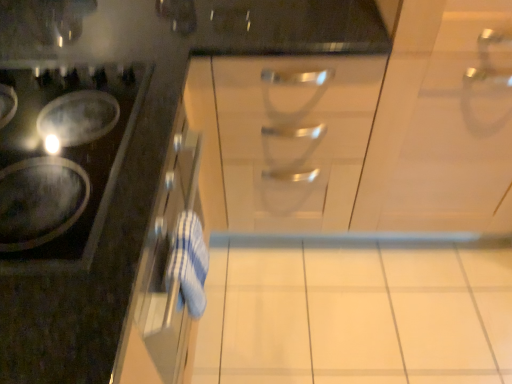
Question: Considering the relative sizes of white glossy cabinet at center, which is the second cabinetry in left-to-right order, and white glossy tile at center in the image provided, is white glossy cabinet at center, which is the second cabinetry in left-to-right order, smaller than white glossy tile at center?

Choices:
 (A) yes
 (B) no

Answer: (B)

Question: Is white glossy cabinet at center, which is the second cabinetry in left-to-right order, at the right side of white glossy tile at center?

Choices:
 (A) yes
 (B) no

Answer: (A)

Question: Does white glossy cabinet at center, the first cabinetry positioned from the right, have a lesser height compared to white glossy tile at center?

Choices:
 (A) no
 (B) yes

Answer: (A)

Question: Does white glossy cabinet at center, the first cabinetry positioned from the right, appear on the left side of white glossy tile at center?

Choices:
 (A) no
 (B) yes

Answer: (A)

Question: From a real-world perspective, is white glossy cabinet at center, the first cabinetry positioned from the right, positioned under white glossy tile at center based on gravity?

Choices:
 (A) no
 (B) yes

Answer: (A)

Question: From the image's perspective, is white glossy cabinet at center, which is the second cabinetry in left-to-right order, under white glossy tile at center?

Choices:
 (A) no
 (B) yes

Answer: (A)

Question: From the image's perspective, would you say shiny black cooktop at left is positioned over satin silver drawer at center?

Choices:
 (A) yes
 (B) no

Answer: (B)

Question: Is shiny black cooktop at left thinner than satin silver drawer at center?

Choices:
 (A) yes
 (B) no

Answer: (A)

Question: Is shiny black cooktop at left shorter than satin silver drawer at center?

Choices:
 (A) yes
 (B) no

Answer: (A)

Question: Does shiny black cooktop at left come behind satin silver drawer at center?

Choices:
 (A) yes
 (B) no

Answer: (B)

Question: Is shiny black cooktop at left positioned far away from satin silver drawer at center?

Choices:
 (A) yes
 (B) no

Answer: (B)

Question: Can you confirm if shiny black cooktop at left is positioned to the left of satin silver drawer at center?

Choices:
 (A) no
 (B) yes

Answer: (B)

Question: Is satin silver drawer at center not close to white glossy cabinet at upper left, the 2th cabinetry when ordered from right to left?

Choices:
 (A) no
 (B) yes

Answer: (A)